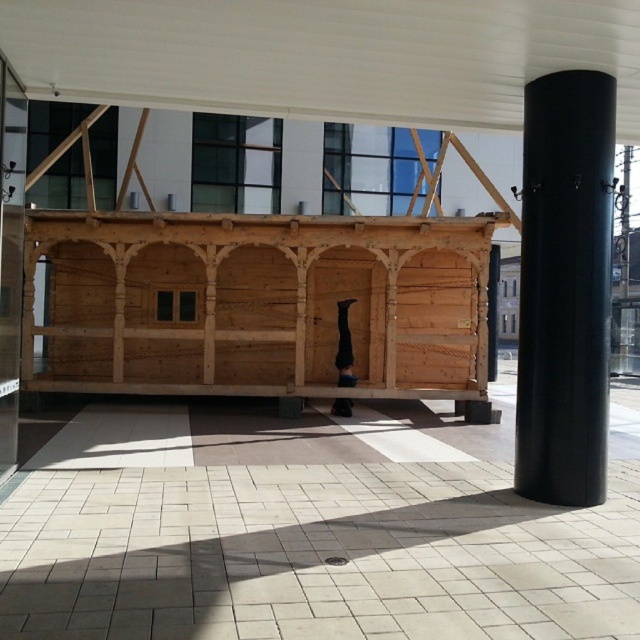
Question: Is natural wood log cabin at center to the right of white matte canopy at upper center from the viewer's perspective?

Choices:
 (A) no
 (B) yes

Answer: (A)

Question: Does natural wood log cabin at center appear on the right side of white matte canopy at upper center?

Choices:
 (A) yes
 (B) no

Answer: (B)

Question: Among these points, which one is farthest from the camera?

Choices:
 (A) (444, 74)
 (B) (600, 99)

Answer: (A)

Question: Which point is farther to the camera?

Choices:
 (A) (358, 346)
 (B) (560, 492)
 (C) (35, 84)

Answer: (A)

Question: Is natural wood log cabin at center to the right of white matte canopy at upper center from the viewer's perspective?

Choices:
 (A) no
 (B) yes

Answer: (A)

Question: Which is farther from the natural wood log cabin at center?

Choices:
 (A) black matte cylinder at right
 (B) white matte canopy at upper center

Answer: (A)